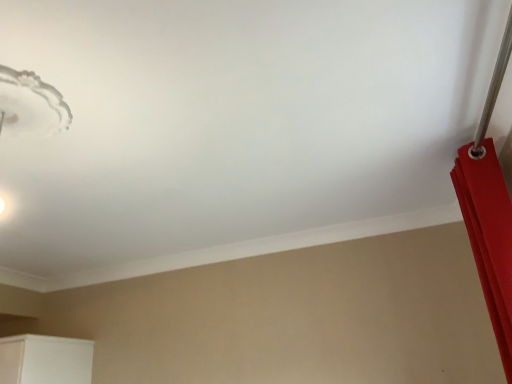
Question: Are white frosted glass lampshade at upper left and matte red curtain at right located far from each other?

Choices:
 (A) no
 (B) yes

Answer: (B)

Question: Considering the relative positions of white frosted glass lampshade at upper left and matte red curtain at right in the image provided, is white frosted glass lampshade at upper left to the left of matte red curtain at right from the viewer's perspective?

Choices:
 (A) no
 (B) yes

Answer: (B)

Question: Considering the relative sizes of white frosted glass lampshade at upper left and matte red curtain at right in the image provided, is white frosted glass lampshade at upper left taller than matte red curtain at right?

Choices:
 (A) no
 (B) yes

Answer: (A)

Question: Does white frosted glass lampshade at upper left appear on the right side of matte red curtain at right?

Choices:
 (A) no
 (B) yes

Answer: (A)

Question: From a real-world perspective, does white frosted glass lampshade at upper left sit lower than matte red curtain at right?

Choices:
 (A) no
 (B) yes

Answer: (A)

Question: Does white frosted glass lampshade at upper left turn towards matte red curtain at right?

Choices:
 (A) no
 (B) yes

Answer: (A)

Question: Considering the relative positions of matte red curtain at right and white frosted glass lampshade at upper left in the image provided, is matte red curtain at right in front of white frosted glass lampshade at upper left?

Choices:
 (A) yes
 (B) no

Answer: (B)

Question: Is there a large distance between matte red curtain at right and white frosted glass lampshade at upper left?

Choices:
 (A) no
 (B) yes

Answer: (B)

Question: Considering the relative sizes of matte red curtain at right and white frosted glass lampshade at upper left in the image provided, is matte red curtain at right thinner than white frosted glass lampshade at upper left?

Choices:
 (A) no
 (B) yes

Answer: (B)

Question: Is matte red curtain at right turned away from white frosted glass lampshade at upper left?

Choices:
 (A) no
 (B) yes

Answer: (A)

Question: Can white frosted glass lampshade at upper left be found inside matte red curtain at right?

Choices:
 (A) no
 (B) yes

Answer: (A)

Question: Considering the relative positions of matte red curtain at right and white frosted glass lampshade at upper left in the image provided, is matte red curtain at right behind white frosted glass lampshade at upper left?

Choices:
 (A) yes
 (B) no

Answer: (A)

Question: Looking at their shapes, would you say matte red curtain at right is wider or thinner than white frosted glass lampshade at upper left?

Choices:
 (A) wide
 (B) thin

Answer: (B)